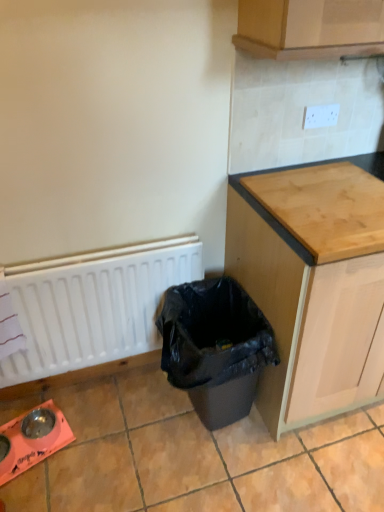
Question: Is wooden cabinet at right inside the boundaries of light brown wood at upper right, or outside?

Choices:
 (A) outside
 (B) inside

Answer: (A)

Question: Considering the positions of point pyautogui.click(x=360, y=325) and point pyautogui.click(x=241, y=183), is point pyautogui.click(x=360, y=325) closer or farther from the camera than point pyautogui.click(x=241, y=183)?

Choices:
 (A) farther
 (B) closer

Answer: (B)

Question: Estimate the real-world distances between objects in this image. Which object is farther from the light brown wood at upper right?

Choices:
 (A) white matte radiator at lower left
 (B) wooden cabinet at right
 (C) black plastic waste bin at lower center

Answer: (A)

Question: Considering the real-world distances, which object is farthest from the black plastic waste bin at lower center?

Choices:
 (A) wooden cabinet at right
 (B) white matte radiator at lower left
 (C) light brown wood at upper right

Answer: (C)